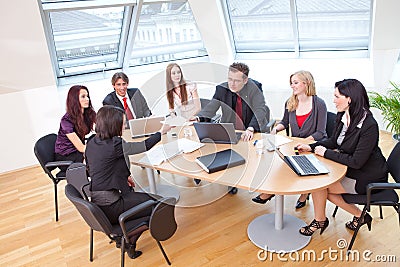
Find the location of `chair legs`. chair legs is located at coordinates (122, 258), (163, 251), (91, 244), (56, 206), (351, 238), (381, 214), (397, 210), (334, 212), (158, 170).